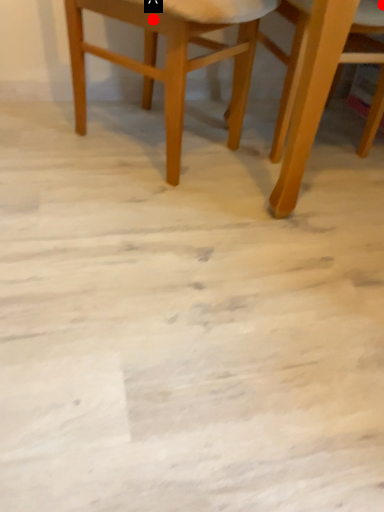
Question: Two points are circled on the image, labeled by A and B beside each circle. Which point is farther to the camera?

Choices:
 (A) A is further
 (B) B is further

Answer: (B)